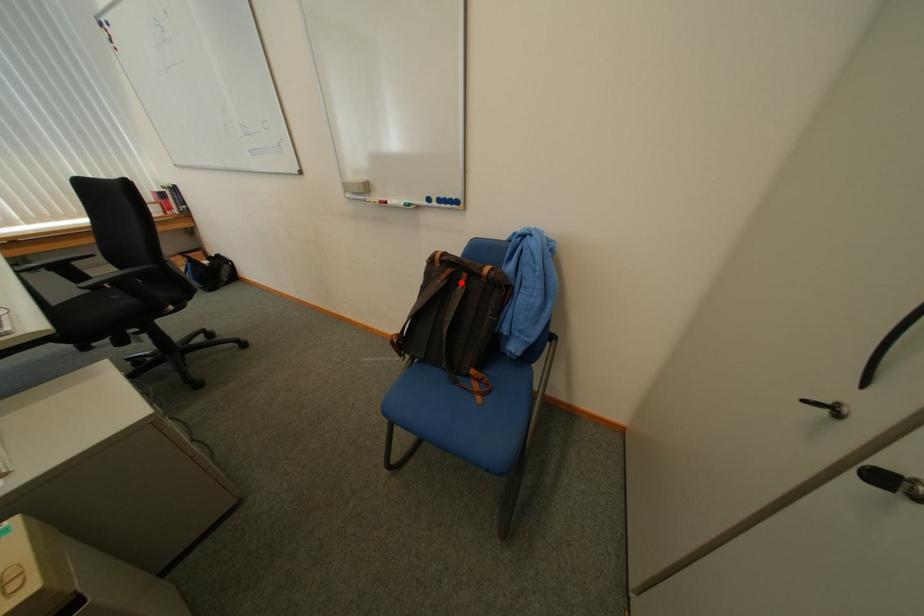
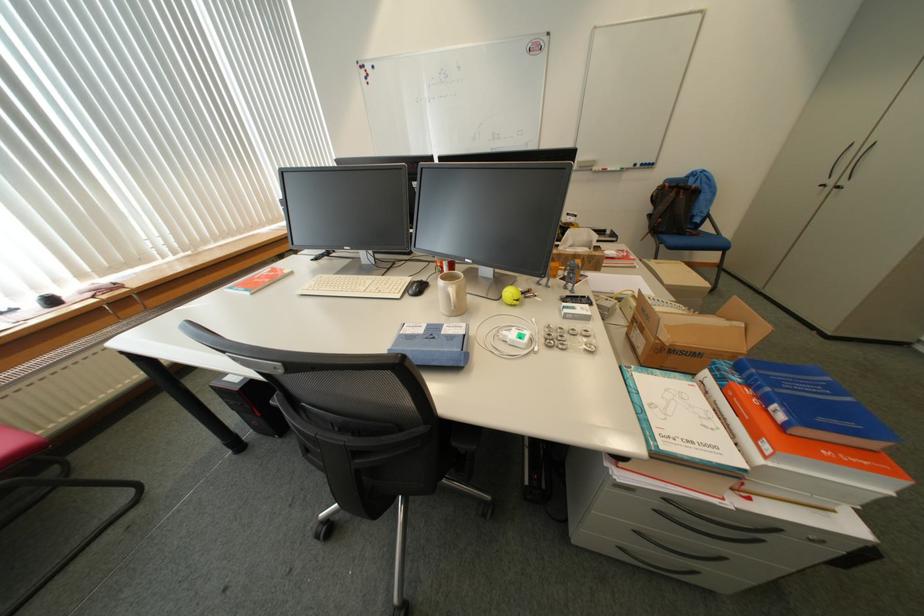
Question: I am providing you with two images of the same scene from different viewpoints. In image1, a red point is highlighted. Considering the same 3D point in image2, which of the following is correct?

Choices:
 (A) It is closer
 (B) It is farther

Answer: (A)